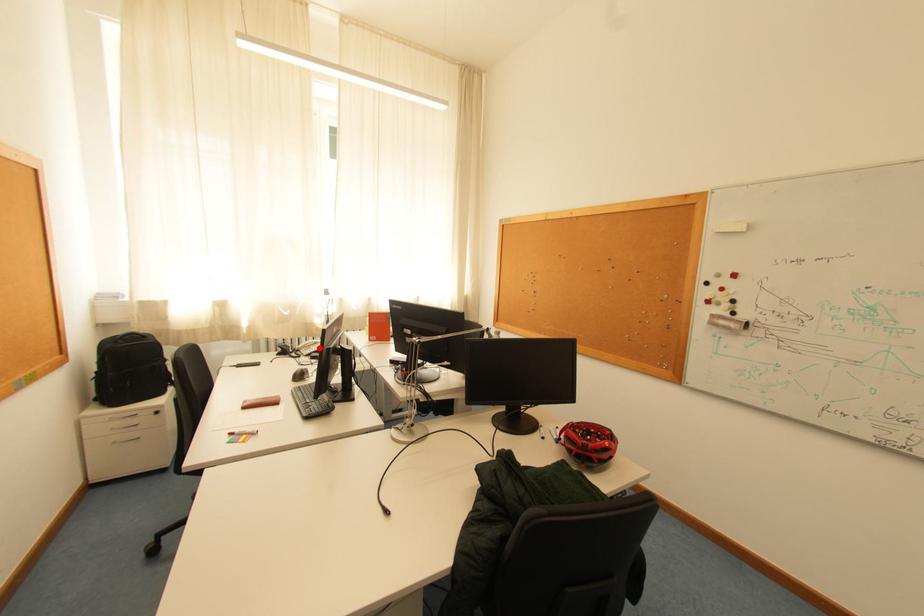
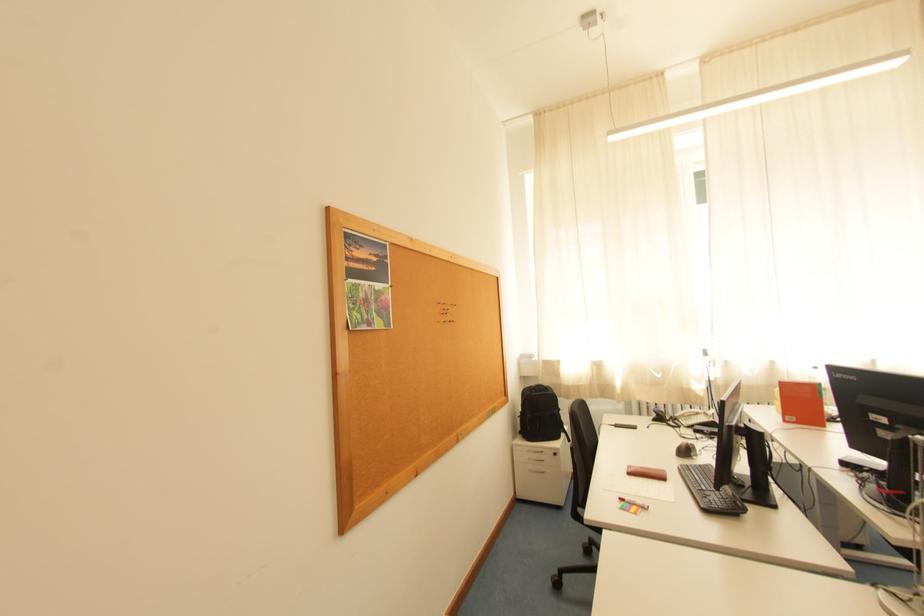
Find the pixel in the second image that matches the highlighted location in the first image.

(699, 418)